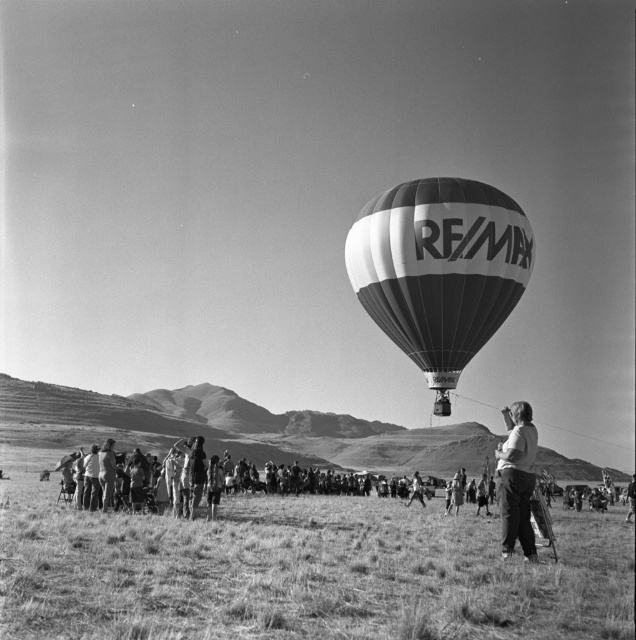
Question: Is grassy field at lower center closer to the viewer compared to dark gray pants at right?

Choices:
 (A) yes
 (B) no

Answer: (A)

Question: Is grassy field at lower center positioned before dark gray pants at right?

Choices:
 (A) yes
 (B) no

Answer: (A)

Question: Which object is the closest to the grassy field at lower center?

Choices:
 (A) dark gray pants at right
 (B) white striped balloon at center

Answer: (A)

Question: Which point is closer to the camera?

Choices:
 (A) dark gray pants at right
 (B) grassy field at lower center
 (C) white striped balloon at center

Answer: (B)

Question: Observing the image, what is the correct spatial positioning of grassy field at lower center in reference to white striped balloon at center?

Choices:
 (A) right
 (B) left

Answer: (B)

Question: Which point is closer to the camera?

Choices:
 (A) (513, 531)
 (B) (4, 513)
 (C) (429, 284)

Answer: (A)